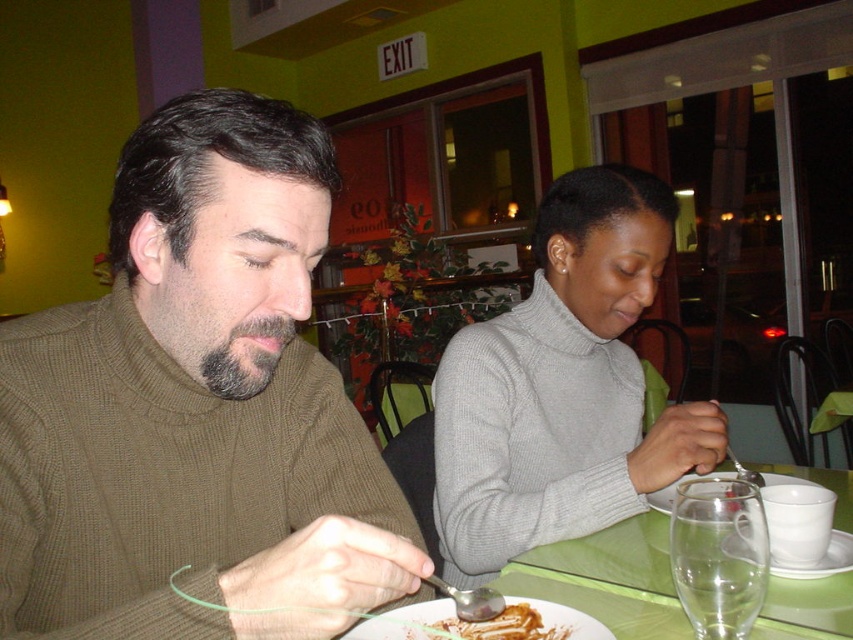
In the scene shown: Can you confirm if green plastic table at lower center is positioned to the left of golden brown crumbly pastry at lower center?

In fact, green plastic table at lower center is to the right of golden brown crumbly pastry at lower center.

Is green plastic table at lower center thinner than golden brown crumbly pastry at lower center?

Incorrect, green plastic table at lower center's width is not less than golden brown crumbly pastry at lower center's.

What do you see at coordinates (605, 563) in the screenshot?
I see `green plastic table at lower center` at bounding box center [605, 563].

The width and height of the screenshot is (853, 640). Find the location of `green plastic table at lower center`. green plastic table at lower center is located at coordinates (605, 563).

Can you confirm if knit brown sweater at left is positioned to the right of golden brown crumbly pastry at lower center?

In fact, knit brown sweater at left is to the left of golden brown crumbly pastry at lower center.

From the picture: Which is more to the left, knit brown sweater at left or golden brown crumbly pastry at lower center?

knit brown sweater at left

What do you see at coordinates (193, 403) in the screenshot? The image size is (853, 640). I see `knit brown sweater at left` at bounding box center [193, 403].

You are a GUI agent. You are given a task and a screenshot of the screen. Output one action in this format:
    pyautogui.click(x=<x>, y=<y>)
    Task: Click on the knit brown sweater at left
    
    Given the screenshot: What is the action you would take?
    pyautogui.click(x=193, y=403)

Does point (450, 492) lie behind point (438, 636)?

Yes, point (450, 492) is behind point (438, 636).

Which of these two, gray woolen sweater at center or golden brown crumbly pastry at lower center, stands shorter?

Standing shorter between the two is golden brown crumbly pastry at lower center.

You are a GUI agent. You are given a task and a screenshot of the screen. Output one action in this format:
    pyautogui.click(x=<x>, y=<y>)
    Task: Click on the gray woolen sweater at center
    The image size is (853, 640).
    Given the screenshot: What is the action you would take?
    pyautogui.click(x=561, y=387)